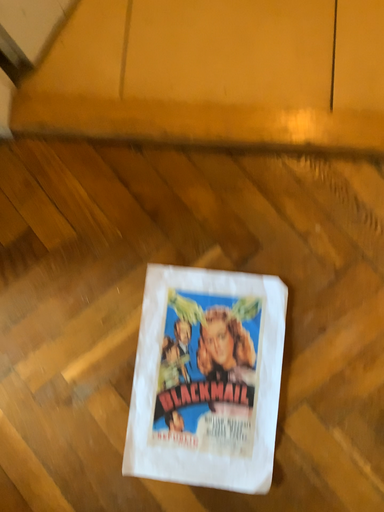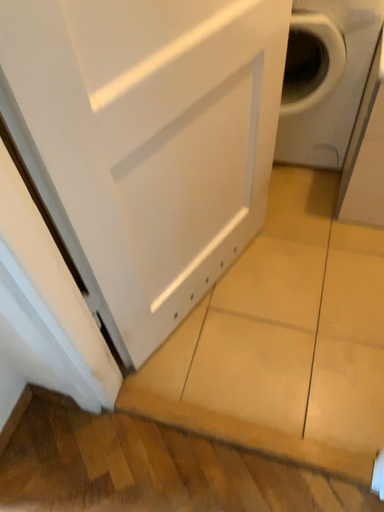
Question: Which way did the camera rotate in the video?

Choices:
 (A) rotated upward
 (B) rotated downward

Answer: (A)